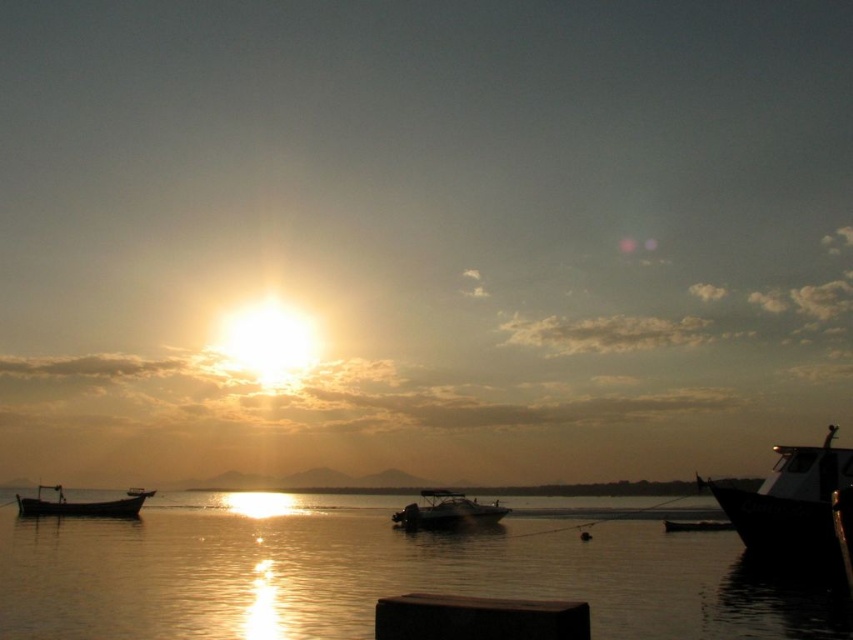
You are standing on the dark wood dock at lower center and want to board the metallic silver boat at lower right. Considering the height difference between them, will you need a ladder or stairs to climb aboard?

The dark wood dock at lower center has a lesser height compared to the metallic silver boat at lower right, so you will need a ladder or stairs to climb aboard.

Consider the image. You are a photographer planning to capture the sunset scene. You want to ensure both the shiny black boat at right and the metallic silver boat at lower right are fully visible in your shot. Based on their sizes, which boat might require you to zoom out more to include its entire width in the frame?

The metallic silver boat at lower right has a greater width than the shiny black boat at right, so you would need to zoom out more to include its entire width in the frame.